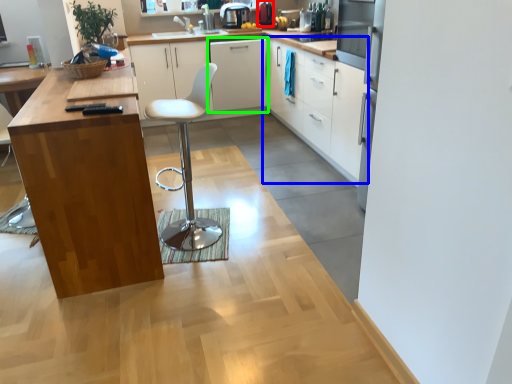
Question: Which object is positioned closest to appliance (highlighted by a red box)? Select from cabinetry (highlighted by a blue box) and cabinetry (highlighted by a green box).

Choices:
 (A) cabinetry
 (B) cabinetry

Answer: (B)